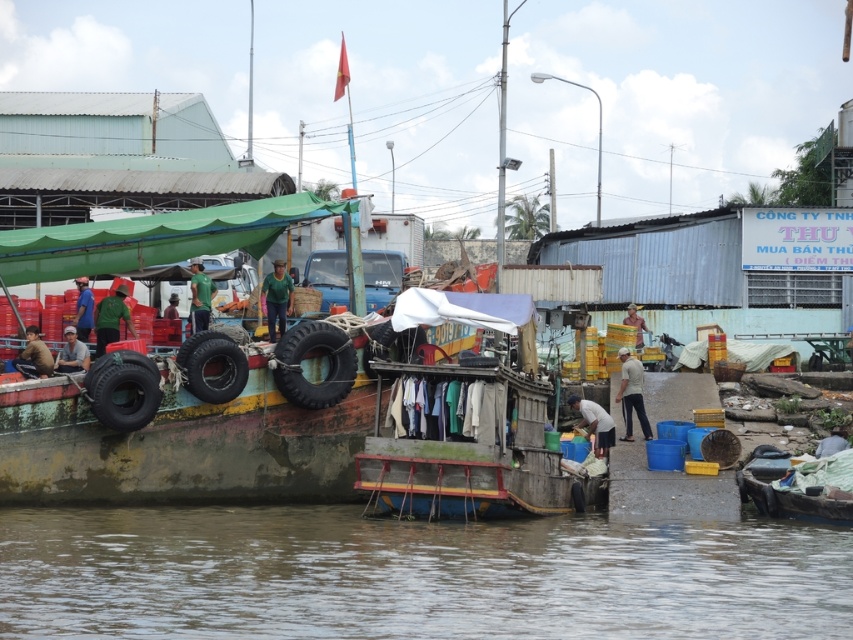
Question: Is rubber matte tire at center to the left of matte black shirt at left from the viewer's perspective?

Choices:
 (A) no
 (B) yes

Answer: (A)

Question: Estimate the real-world distances between objects in this image. Which object is closer to the light brown wooden pole at center?

Choices:
 (A) rubber matte tire at center
 (B) light gray fabric at lower right

Answer: (B)

Question: Which object is positioned farthest from the white fabric bag at lower center?

Choices:
 (A) green fabric shirt at center
 (B) rubber/tire at center
 (C) light gray fabric at lower right

Answer: (A)

Question: Observing the image, what is the correct spatial positioning of green matte shirt at center in reference to green matte shirt at left?

Choices:
 (A) above
 (B) below

Answer: (A)

Question: Which point is farther to the camera?

Choices:
 (A) green matte shirt at left
 (B) rubber matte tire at lower left
 (C) white matte shirt at center
 (D) wooden boat at center

Answer: (C)

Question: Can you confirm if rubber matte tire at lower left is positioned to the right of green matte shirt at center?

Choices:
 (A) yes
 (B) no

Answer: (B)